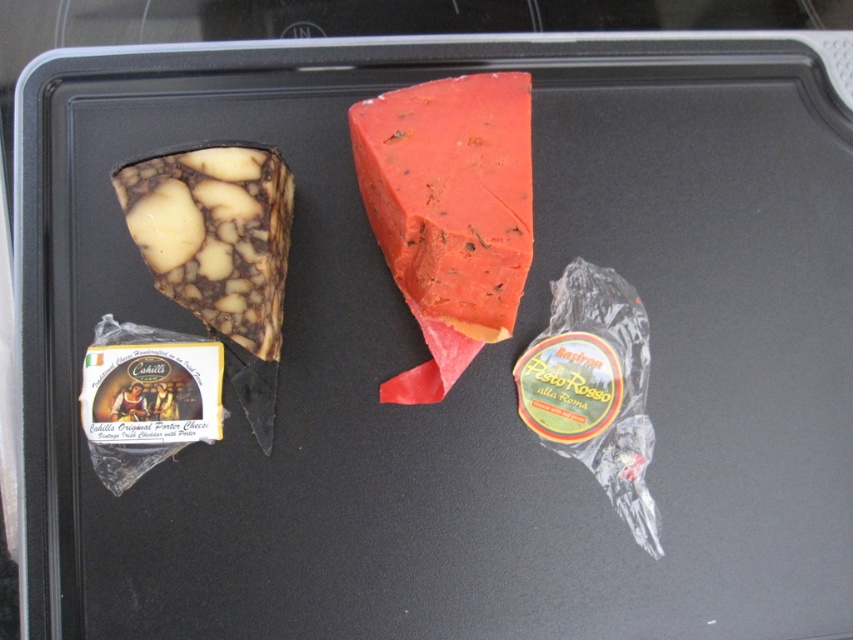
Is point (488, 196) positioned in front of point (607, 451)?

Yes, it is in front of point (607, 451).

Who is more forward, (520, 224) or (548, 330)?

Point (520, 224) is more forward.

Find the location of `red matte cheese at center`. red matte cheese at center is located at coordinates (451, 195).

Is marbled cheese at left bigger than translucent plastic pesto rosso at center?

Indeed, marbled cheese at left has a larger size compared to translucent plastic pesto rosso at center.

Describe the element at coordinates (215, 236) in the screenshot. I see `marbled cheese at left` at that location.

You are a GUI agent. You are given a task and a screenshot of the screen. Output one action in this format:
    pyautogui.click(x=<x>, y=<y>)
    Task: Click on the marbled cheese at left
    
    Given the screenshot: What is the action you would take?
    pyautogui.click(x=215, y=236)

Can you confirm if red matte cheese at center is positioned to the right of marbled cheese at left?

Correct, you'll find red matte cheese at center to the right of marbled cheese at left.

Is red matte cheese at center to the left of marbled cheese at left from the viewer's perspective?

Incorrect, red matte cheese at center is not on the left side of marbled cheese at left.

Describe the element at coordinates (451, 195) in the screenshot. This screenshot has width=853, height=640. I see `red matte cheese at center` at that location.

At what (x,y) coordinates should I click in order to perform the action: click on red matte cheese at center. Please return your answer as a coordinate pair (x, y). Looking at the image, I should click on (451, 195).